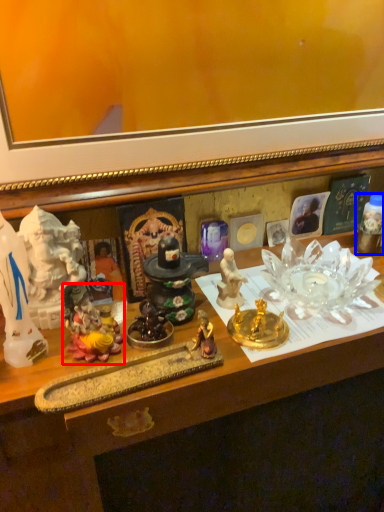
Question: Which object is closer to the camera taking this photo, toy (highlighted by a red box) or toy (highlighted by a blue box)?

Choices:
 (A) toy
 (B) toy

Answer: (A)